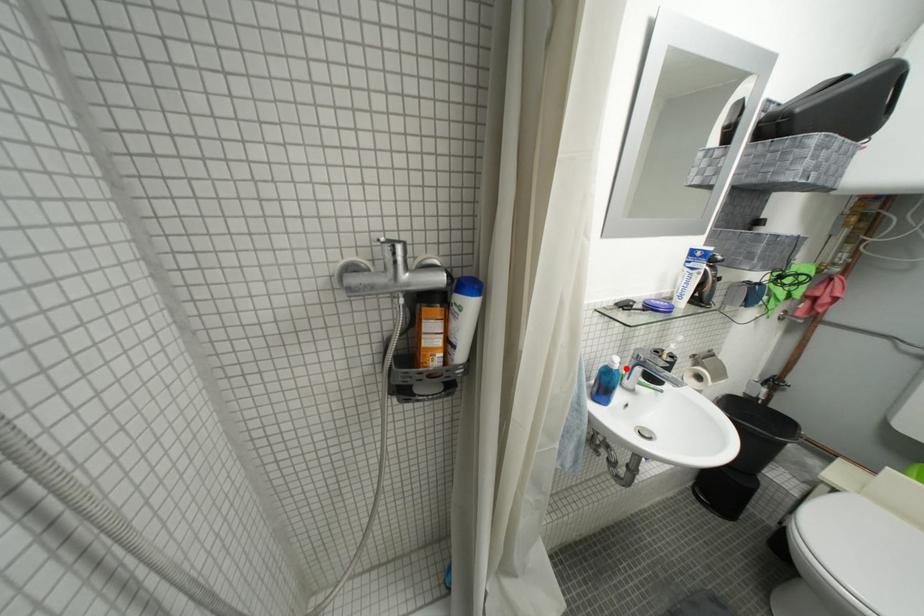
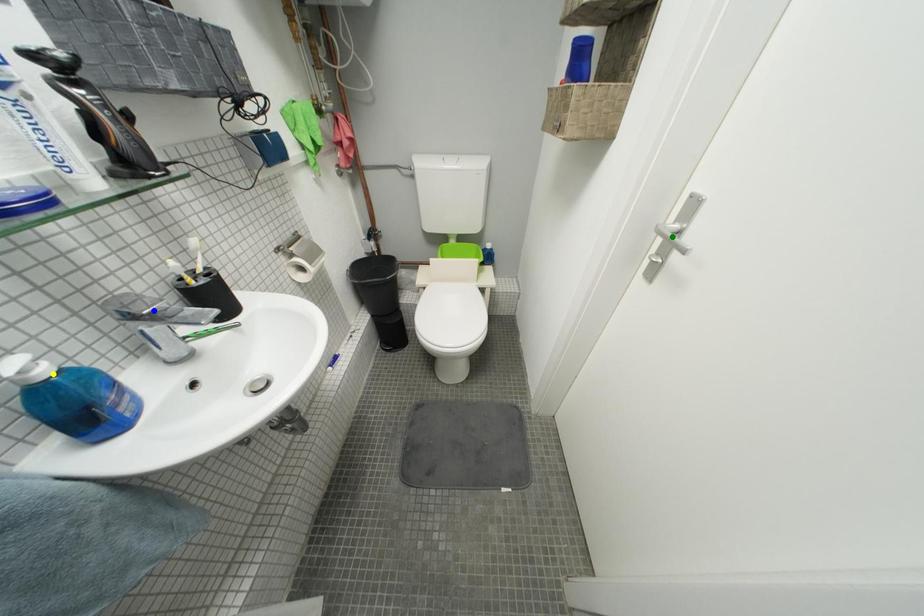
Question: I am providing you with two images of the same scene from different viewpoints. A red point is marked on the first image. You are given multiple points on the second image. In image 2, which mark is for the same physical point as the one in image 1?

Choices:
 (A) blue point
 (B) yellow point
 (C) green point

Answer: (B)